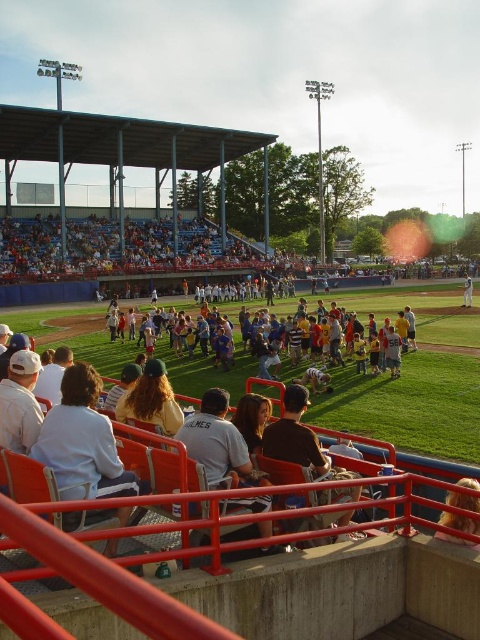
You are a photographer standing at the edge of the baseball field. You want to take a photo that includes both the light brown leather jacket at lower right and the white jersey at center. Which object should you adjust your camera angle to capture first if you want to ensure both are in the frame?

The light brown leather jacket at lower right is located below the white jersey at center, so you should adjust your camera angle to capture the light brown leather jacket at lower right first to ensure the white jersey at center is within the frame.

You are a photographer standing at the edge of the baseball field. You want to take a photo of the white jersey at center without the light blue shirt at lower left blocking the view. Can you adjust your position to do so?

The light blue shirt at lower left is in front of the white jersey at center, so moving to the side might allow you to see around the obstruction. Try shifting your position to the right or left to get a clearer view of the white jersey at center without the light blue shirt at lower left blocking it.